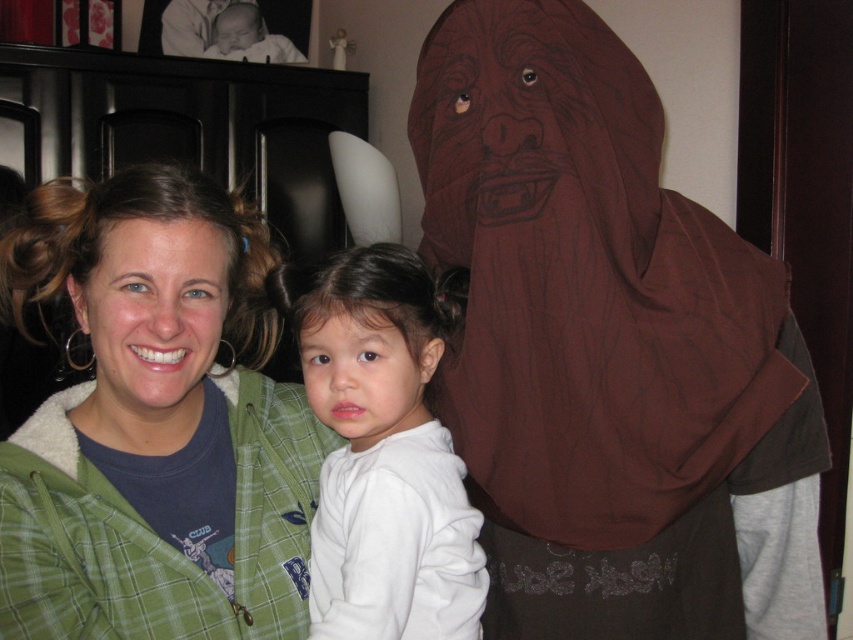
Question: Among these points, which one is nearest to the camera?

Choices:
 (A) (556, 280)
 (B) (264, 579)

Answer: (B)

Question: Does green plaid jacket at center have a smaller size compared to white soft sweatshirt at center?

Choices:
 (A) no
 (B) yes

Answer: (A)

Question: Which object appears farthest from the camera in this image?

Choices:
 (A) brown fabric mask at right
 (B) green plaid jacket at center
 (C) white soft sweatshirt at center

Answer: (A)

Question: Does brown fabric mask at right have a larger size compared to green plaid jacket at center?

Choices:
 (A) yes
 (B) no

Answer: (B)

Question: Estimate the real-world distances between objects in this image. Which object is farther from the brown fabric mask at right?

Choices:
 (A) white soft sweatshirt at center
 (B) green plaid jacket at center

Answer: (B)

Question: Can you confirm if green plaid jacket at center is positioned to the right of white soft sweatshirt at center?

Choices:
 (A) no
 (B) yes

Answer: (A)